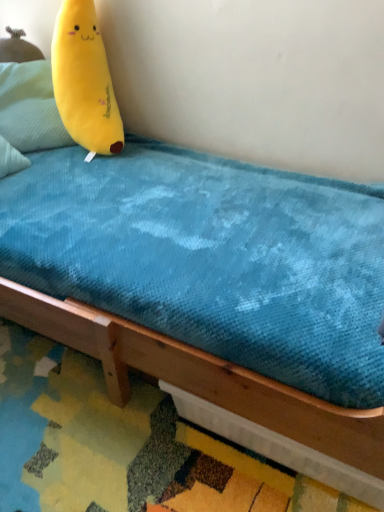
Question: Does yellow plush at upper left have a smaller size compared to yellow plush at upper left?

Choices:
 (A) yes
 (B) no

Answer: (B)

Question: Is yellow plush at upper left not close to yellow plush at upper left?

Choices:
 (A) yes
 (B) no

Answer: (B)

Question: Does yellow plush at upper left have a lesser width compared to yellow plush at upper left?

Choices:
 (A) yes
 (B) no

Answer: (B)

Question: From a real-world perspective, is yellow plush at upper left physically below yellow plush at upper left?

Choices:
 (A) no
 (B) yes

Answer: (A)

Question: Is yellow plush at upper left not within yellow plush at upper left?

Choices:
 (A) yes
 (B) no

Answer: (A)

Question: From the image's perspective, is yellow plush at upper left located above yellow plush at upper left?

Choices:
 (A) no
 (B) yes

Answer: (A)

Question: Considering the relative positions of yellow plush at upper left and yellow plush at upper left in the image provided, is yellow plush at upper left to the left of yellow plush at upper left from the viewer's perspective?

Choices:
 (A) no
 (B) yes

Answer: (B)

Question: Does yellow plush at upper left have a greater width compared to yellow plush at upper left?

Choices:
 (A) yes
 (B) no

Answer: (B)

Question: Is the depth of yellow plush at upper left less than that of yellow plush at upper left?

Choices:
 (A) no
 (B) yes

Answer: (A)

Question: From the image's perspective, would you say yellow plush at upper left is shown under yellow plush at upper left?

Choices:
 (A) no
 (B) yes

Answer: (A)

Question: Is yellow plush at upper left thinner than yellow plush at upper left?

Choices:
 (A) no
 (B) yes

Answer: (B)

Question: Can you confirm if yellow plush at upper left is shorter than yellow plush at upper left?

Choices:
 (A) yes
 (B) no

Answer: (A)

Question: Would you say yellow plush at upper left is to the left or to the right of yellow plush at upper left in the picture?

Choices:
 (A) left
 (B) right

Answer: (B)